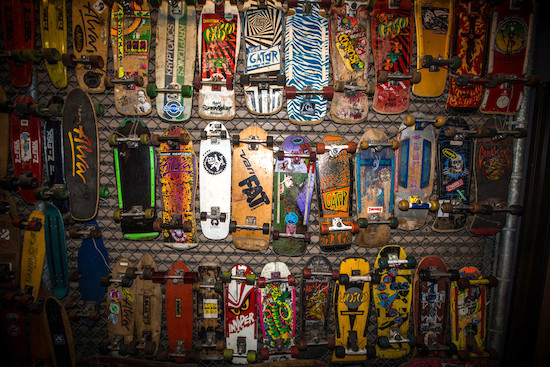
Identify the location of corner. The image size is (550, 367). point(532,19).